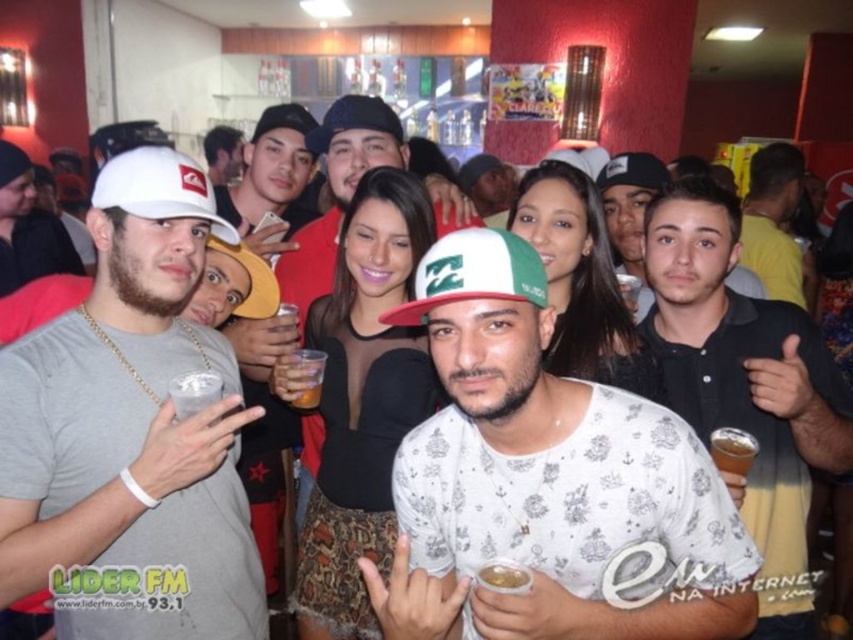
Question: Which of the following is the closest to the observer?

Choices:
 (A) (421, 570)
 (B) (689, 355)
 (C) (648, 186)

Answer: (A)

Question: Is white cotton shirt at center closer to the viewer compared to white matte cap at left?

Choices:
 (A) no
 (B) yes

Answer: (B)

Question: Which object is closer to the camera taking this photo?

Choices:
 (A) yellow fabric baseball cap at center
 (B) white cotton shirt at center
 (C) white matte cap at left

Answer: (B)

Question: Can you confirm if black matte shirt at center is smaller than matte black cap at center?

Choices:
 (A) no
 (B) yes

Answer: (A)

Question: Which point is closer to the camera?

Choices:
 (A) white matte baseball cap at left
 (B) matte black cap at center
 (C) matte white cap at center

Answer: (A)

Question: Is white matte cap at left in front of white matte baseball cap at center?

Choices:
 (A) no
 (B) yes

Answer: (A)